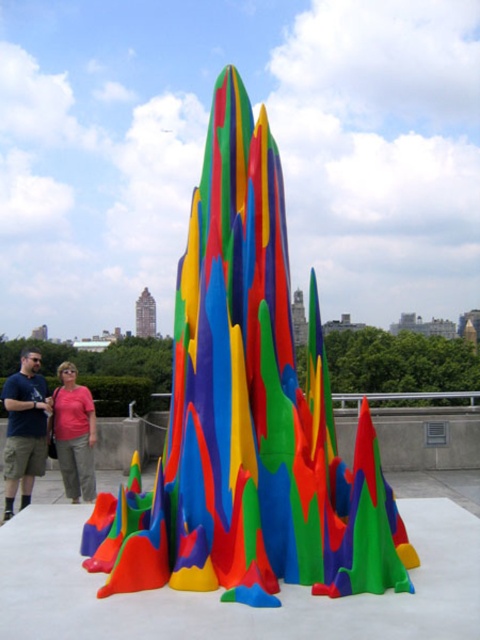
Looking at this image, measure the distance between glossy plastic sculpture at center and camera.

The distance of glossy plastic sculpture at center from camera is 8.93 meters.

Does glossy plastic sculpture at center have a lesser width compared to matte black shirt at left?

Correct, glossy plastic sculpture at center's width is less than matte black shirt at left's.

Between point (194, 333) and point (11, 374), which one is positioned behind?

The point (11, 374) is more distant.

Identify the location of glossy plastic sculpture at center. (248, 416).

Does glossy plastic sculpture at center have a smaller size compared to pink cotton shirt at lower left?

Yes.

Which is more to the right, glossy plastic sculpture at center or pink cotton shirt at lower left?

glossy plastic sculpture at center is more to the right.

What do you see at coordinates (248, 416) in the screenshot? The image size is (480, 640). I see `glossy plastic sculpture at center` at bounding box center [248, 416].

At what (x,y) coordinates should I click in order to perform the action: click on glossy plastic sculpture at center. Please return your answer as a coordinate pair (x, y). Image resolution: width=480 pixels, height=640 pixels. Looking at the image, I should click on (248, 416).

What do you see at coordinates (24, 429) in the screenshot? I see `matte black shirt at left` at bounding box center [24, 429].

Can you confirm if matte black shirt at left is taller than pink cotton shirt at lower left?

Yes.

The height and width of the screenshot is (640, 480). What do you see at coordinates (24, 429) in the screenshot?
I see `matte black shirt at left` at bounding box center [24, 429].

The height and width of the screenshot is (640, 480). I want to click on matte black shirt at left, so click(24, 429).